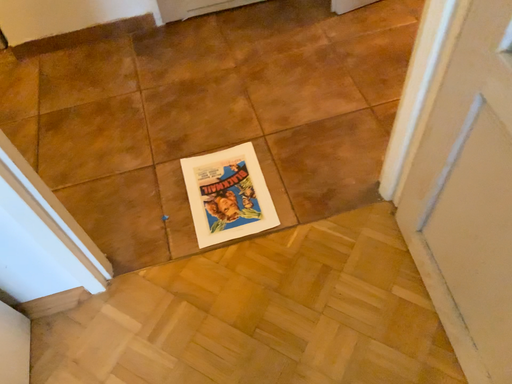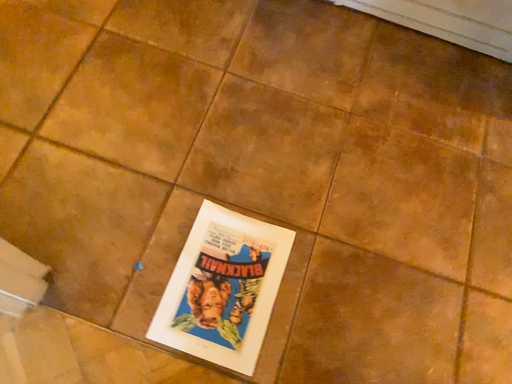
Question: How did the camera likely rotate when shooting the video?

Choices:
 (A) rotated right
 (B) rotated left

Answer: (B)